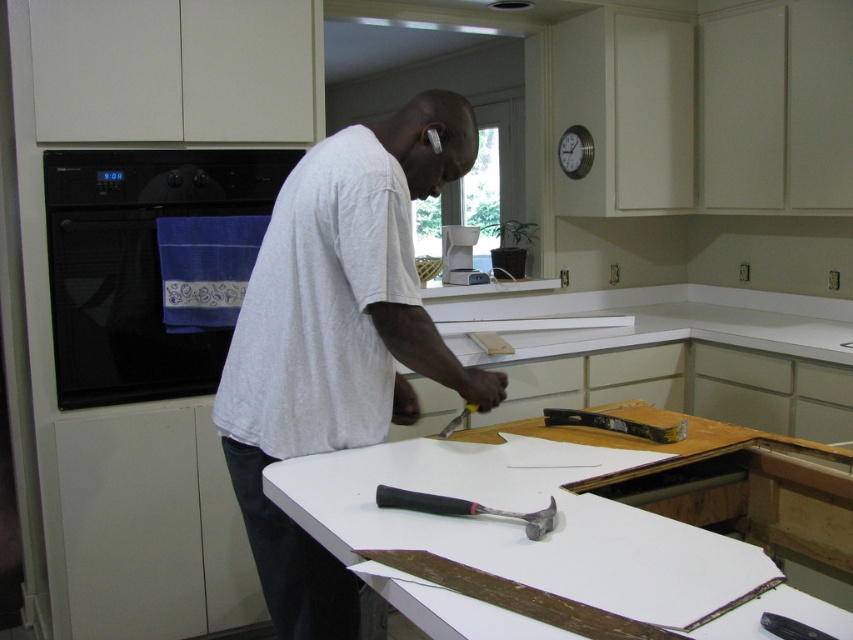
Does white laminate counter top at center have a lesser height compared to white plastic coffee maker at center?

Yes.

Which is in front, point (576, 524) or point (468, 266)?

Point (576, 524) is in front.

This screenshot has height=640, width=853. Find the location of `white laminate counter top at center`. white laminate counter top at center is located at coordinates (547, 536).

Is point (596, 508) positioned before point (421, 496)?

No, it is behind (421, 496).

Does white laminate counter top at center come in front of black rubber hammer at center?

Yes, white laminate counter top at center is in front of black rubber hammer at center.

Who is more distant from viewer, (x=541, y=481) or (x=415, y=493)?

The point (x=541, y=481) is behind.

You are a GUI agent. You are given a task and a screenshot of the screen. Output one action in this format:
    pyautogui.click(x=<x>, y=<y>)
    Task: Click on the white laminate counter top at center
    This screenshot has width=853, height=640.
    Given the screenshot: What is the action you would take?
    [547, 536]

Between black rubber hammer at center and metallic silver level at center, which one is positioned higher?

metallic silver level at center is higher up.

Does black rubber hammer at center have a greater width compared to metallic silver level at center?

In fact, black rubber hammer at center might be narrower than metallic silver level at center.

Where is `black rubber hammer at center`? The image size is (853, 640). black rubber hammer at center is located at coordinates (463, 508).

Where is `black rubber hammer at center`? Image resolution: width=853 pixels, height=640 pixels. black rubber hammer at center is located at coordinates (463, 508).